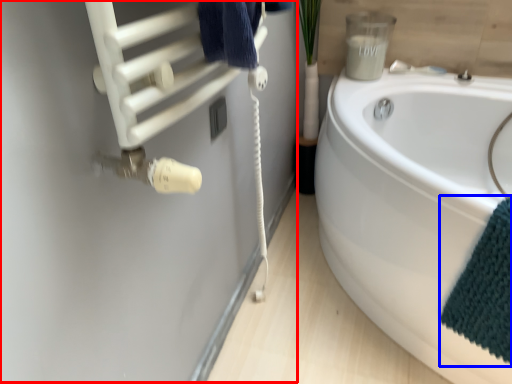
Question: Which point is further to the camera, wool (highlighted by a red box) or bath towel (highlighted by a blue box)?

Choices:
 (A) wool
 (B) bath towel

Answer: (B)